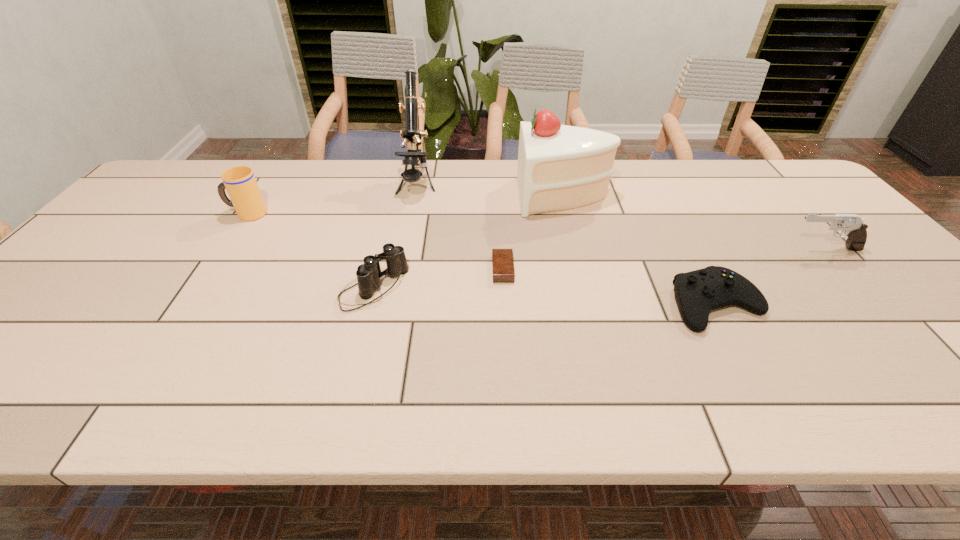
Identify the location of vacant space in between the control and the fourth object from left to right. (610, 287).

Where is `empty location between the second shortest object and the leftmost object`? empty location between the second shortest object and the leftmost object is located at coordinates (482, 259).

You are a GUI agent. You are given a task and a screenshot of the screen. Output one action in this format:
    pyautogui.click(x=<x>, y=<y>)
    Task: Click on the vacant region between the second shortest object and the sixth shortest object
    
    Given the screenshot: What is the action you would take?
    pyautogui.click(x=639, y=250)

You are a GUI agent. You are given a task and a screenshot of the screen. Output one action in this format:
    pyautogui.click(x=<x>, y=<y>)
    Task: Click on the object identified as the third closest to the third shortest object
    This screenshot has height=540, width=960.
    Given the screenshot: What is the action you would take?
    240,183

Where is `object that stands as the sixth closest to the alarm clock`? object that stands as the sixth closest to the alarm clock is located at coordinates (855, 229).

You are a GUI agent. You are given a task and a screenshot of the screen. Output one action in this format:
    pyautogui.click(x=<x>, y=<y>)
    Task: Click on the vacant space that satisfies the following two spatial constraints: 1. on the front face of the second object from right to left; 2. on the left side of the alarm clock
    The image size is (960, 540).
    Given the screenshot: What is the action you would take?
    pyautogui.click(x=505, y=305)

Find the location of `blank space that satisfies the following two spatial constraints: 1. on the back side of the third object from right to left; 2. on the left side of the binoculars`. blank space that satisfies the following two spatial constraints: 1. on the back side of the third object from right to left; 2. on the left side of the binoculars is located at coordinates (397, 196).

Image resolution: width=960 pixels, height=540 pixels. I want to click on free space in the image that satisfies the following two spatial constraints: 1. on the back side of the second object from right to left; 2. on the front face of the alarm clock, so click(x=697, y=269).